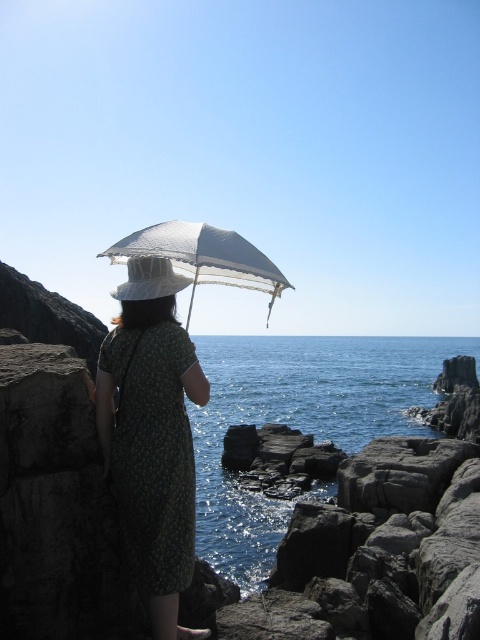
Does green floral dress at left have a larger size compared to white woven hat at center?

Indeed, green floral dress at left has a larger size compared to white woven hat at center.

This screenshot has height=640, width=480. I want to click on green floral dress at left, so click(153, 452).

Is point (182, 332) positioned after point (152, 285)?

Yes, it is.

Identify the location of green floral dress at left. The width and height of the screenshot is (480, 640). (153, 452).

Does green floral dress at left appear on the right side of white lace umbrella at center?

Indeed, green floral dress at left is positioned on the right side of white lace umbrella at center.

Is green floral dress at left taller than white lace umbrella at center?

Incorrect, green floral dress at left's height is not larger of white lace umbrella at center's.

I want to click on green floral dress at left, so click(153, 452).

The width and height of the screenshot is (480, 640). Identify the location of green floral dress at left. (153, 452).

Who is shorter, white lace umbrella at center or white woven hat at center?

Standing shorter between the two is white woven hat at center.

Between point (255, 269) and point (131, 294), which one is positioned behind?

Positioned behind is point (255, 269).

Which is in front, point (230, 268) or point (153, 272)?

Point (153, 272)

You are a GUI agent. You are given a task and a screenshot of the screen. Output one action in this format:
    pyautogui.click(x=<x>, y=<y>)
    Task: Click on the white lace umbrella at center
    The width and height of the screenshot is (480, 640).
    Given the screenshot: What is the action you would take?
    pyautogui.click(x=204, y=257)